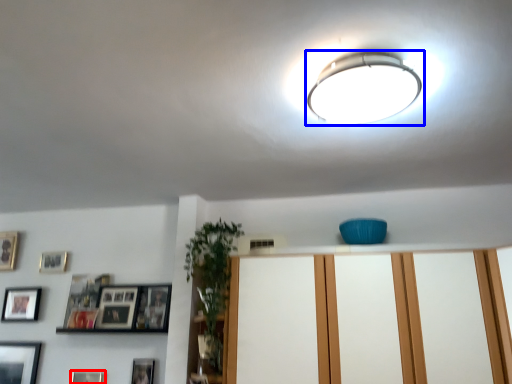
Question: Which object is closer to the camera taking this photo, picture frame (highlighted by a red box) or lamp (highlighted by a blue box)?

Choices:
 (A) picture frame
 (B) lamp

Answer: (B)